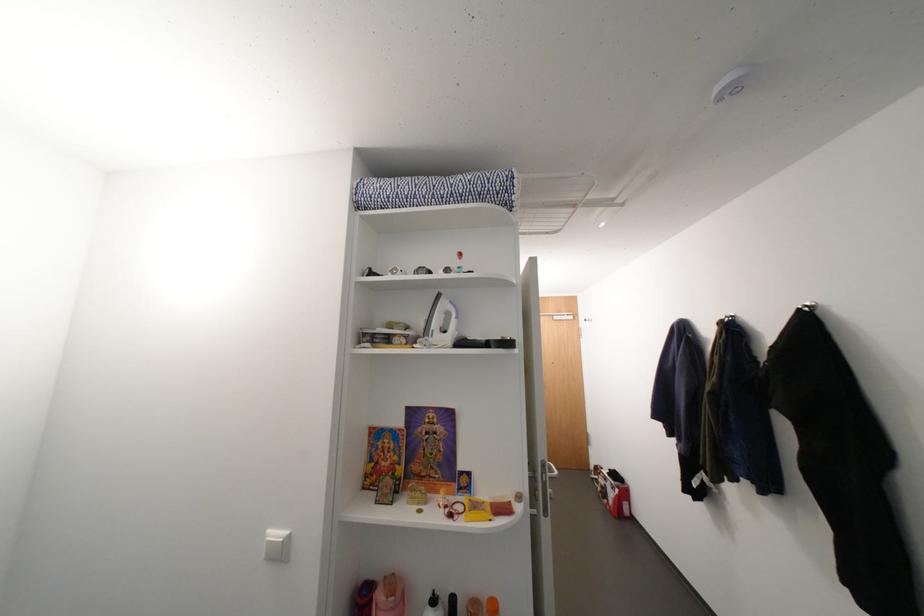
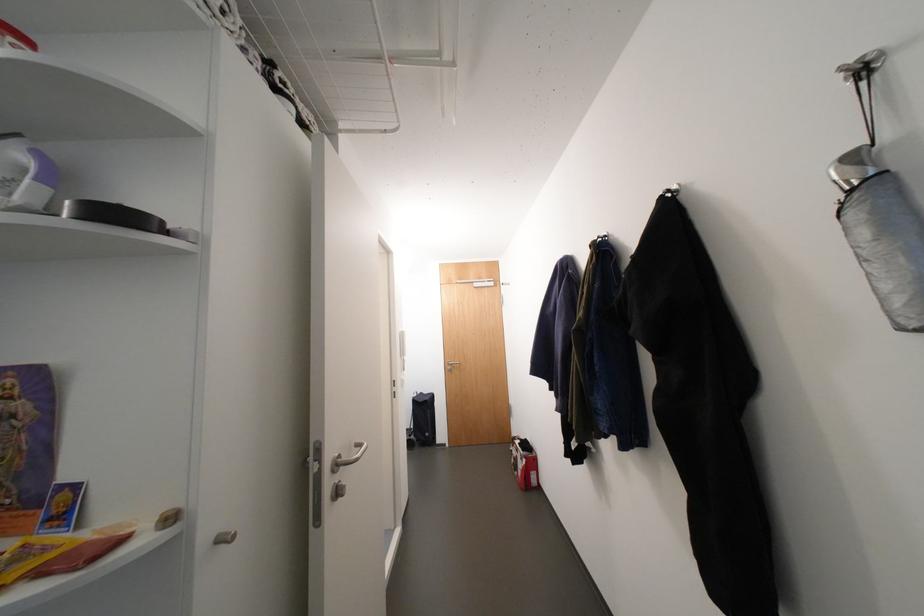
Question: The camera is either moving clockwise (left) or counter-clockwise (right) around the object. The first image is from the beginning of the video and the second image is from the end. Is the camera moving left or right when shooting the video?

Choices:
 (A) Left
 (B) Right

Answer: (A)